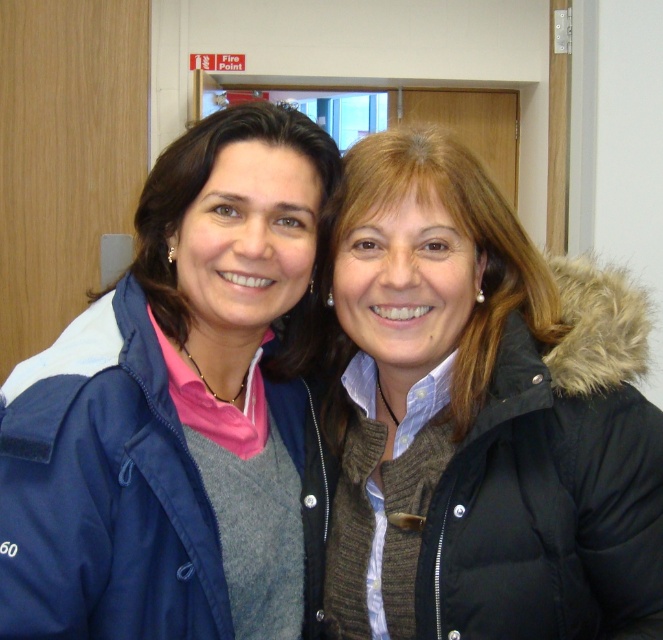
Question: Among these points, which one is nearest to the camera?

Choices:
 (A) (129, 326)
 (B) (617, 586)

Answer: (B)

Question: Is black puffy jacket at right bigger than navy blue jacket at left?

Choices:
 (A) yes
 (B) no

Answer: (A)

Question: Among these objects, which one is nearest to the camera?

Choices:
 (A) black puffy jacket at right
 (B) navy blue jacket at left

Answer: (B)

Question: Is black puffy jacket at right smaller than navy blue jacket at left?

Choices:
 (A) yes
 (B) no

Answer: (B)

Question: Can you confirm if black puffy jacket at right is positioned to the left of navy blue jacket at left?

Choices:
 (A) yes
 (B) no

Answer: (B)